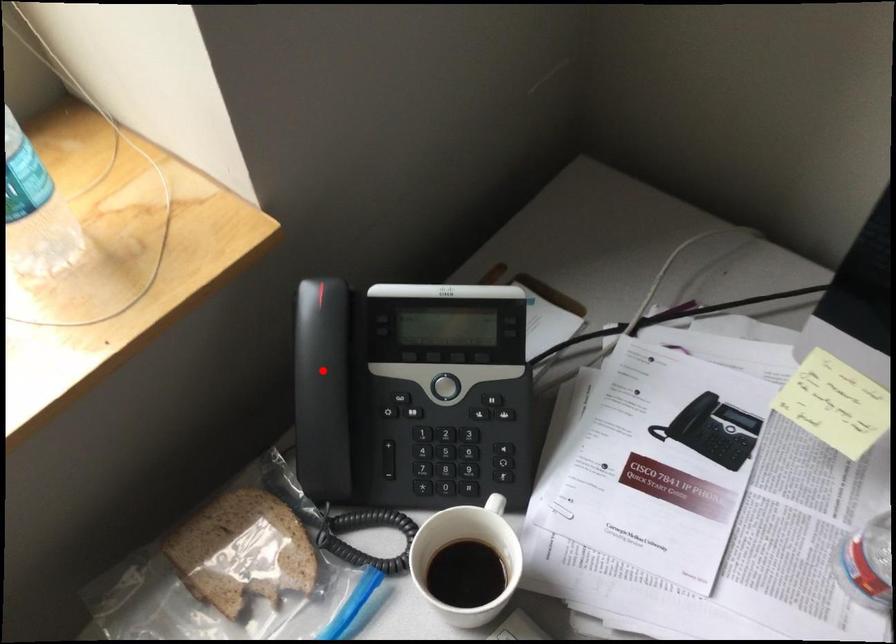
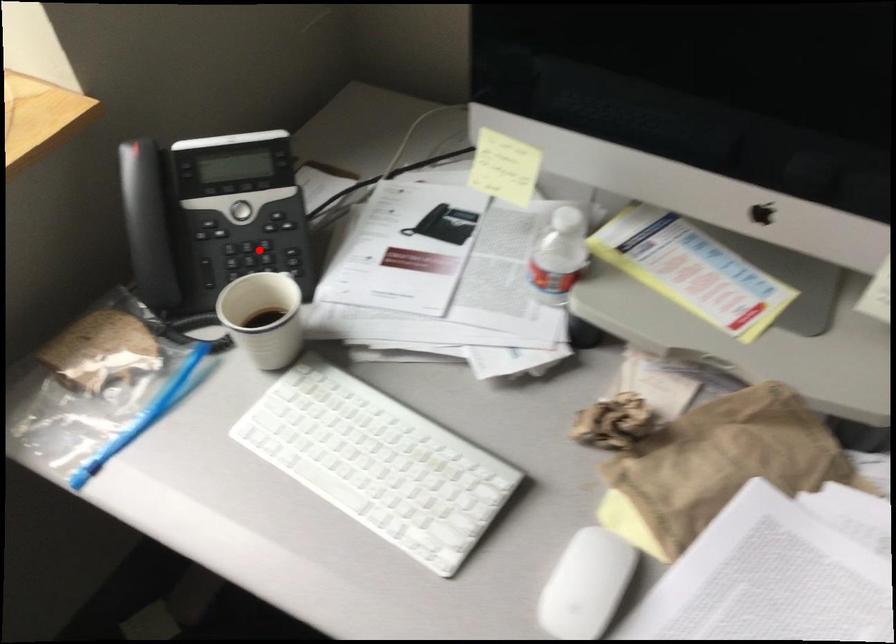
I am providing you with two images of the same scene from different viewpoints. A red point is marked on the first image and another point is marked on the second image. Does the point marked in image1 correspond to the same location as the one in image2?

No